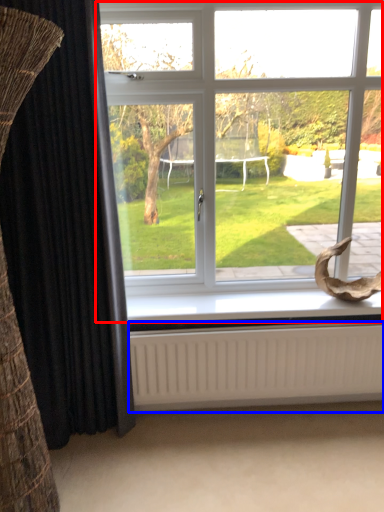
Question: Among these objects, which one is farthest to the camera, window (highlighted by a red box) or radiator (highlighted by a blue box)?

Choices:
 (A) window
 (B) radiator

Answer: (B)